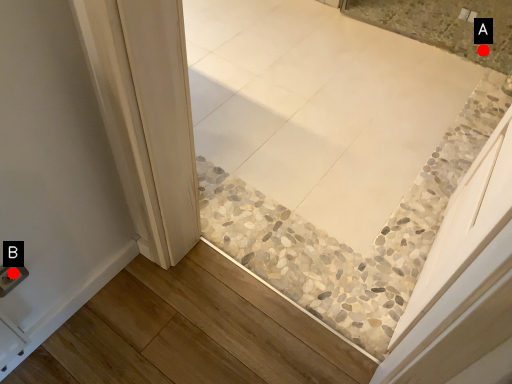
Question: Two points are circled on the image, labeled by A and B beside each circle. Among these points, which one is farthest from the camera?

Choices:
 (A) A is further
 (B) B is further

Answer: (A)